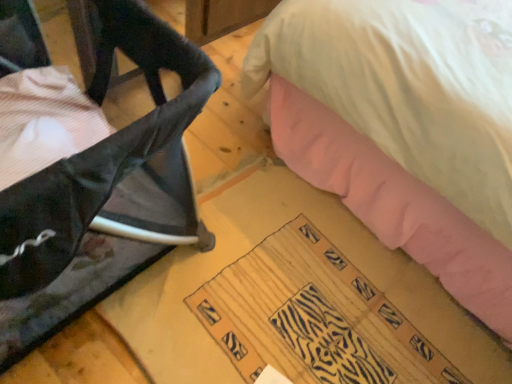
Question: From a real-world perspective, is black mesh chair at left physically located above or below zebra-patterned fabric at lower center?

Choices:
 (A) above
 (B) below

Answer: (A)

Question: Does point (188, 97) appear closer or farther from the camera than point (369, 362)?

Choices:
 (A) closer
 (B) farther

Answer: (A)

Question: From the image's perspective, is black mesh chair at left located above or below zebra-patterned fabric at lower center?

Choices:
 (A) below
 (B) above

Answer: (B)

Question: From the image's perspective, is zebra-patterned fabric at lower center positioned above or below black mesh chair at left?

Choices:
 (A) below
 (B) above

Answer: (A)

Question: Do you think zebra-patterned fabric at lower center is within black mesh chair at left, or outside of it?

Choices:
 (A) inside
 (B) outside

Answer: (B)

Question: Relative to black mesh chair at left, is zebra-patterned fabric at lower center in front or behind?

Choices:
 (A) behind
 (B) front

Answer: (A)

Question: Considering the positions of zebra-patterned fabric at lower center and black mesh chair at left in the image, is zebra-patterned fabric at lower center taller or shorter than black mesh chair at left?

Choices:
 (A) short
 (B) tall

Answer: (A)